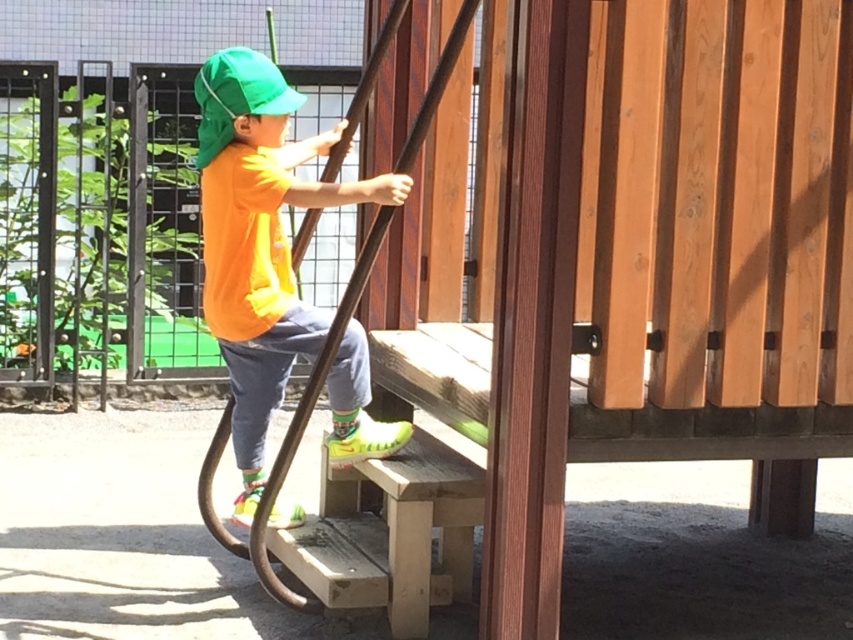
You are a photographer trying to capture a shot of the child in the playground. You need to position yourself so that the matte orange shirt at center and the green fabric cap at upper left are both visible in the frame. Which object should you place closer to the left side of your camera viewfinder to ensure both are in the shot?

You should place the green fabric cap at upper left closer to the left side of your camera viewfinder since it is already positioned to the left of the matte orange shirt at center.